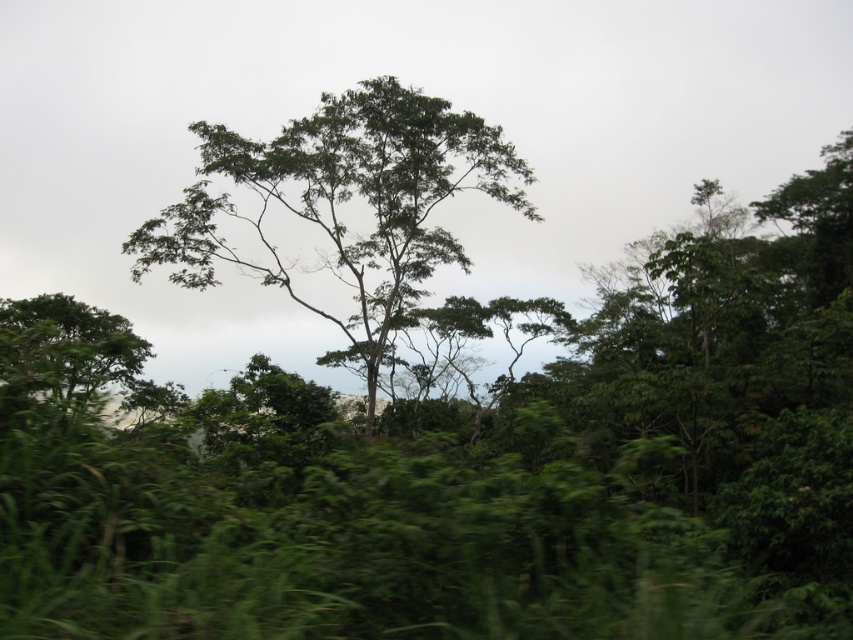
Question: Is green leafy tree at center below green leafy tree at lower left?

Choices:
 (A) no
 (B) yes

Answer: (A)

Question: Which of the following is the closest to the observer?

Choices:
 (A) (0, 378)
 (B) (511, 205)

Answer: (A)

Question: Can you confirm if green leafy tree at center is positioned above green leafy tree at lower left?

Choices:
 (A) no
 (B) yes

Answer: (B)

Question: Observing the image, what is the correct spatial positioning of green leafy tree at center in reference to green leafy tree at lower left?

Choices:
 (A) left
 (B) right

Answer: (B)

Question: Which point appears farthest from the camera in this image?

Choices:
 (A) (361, 170)
 (B) (100, 385)

Answer: (A)